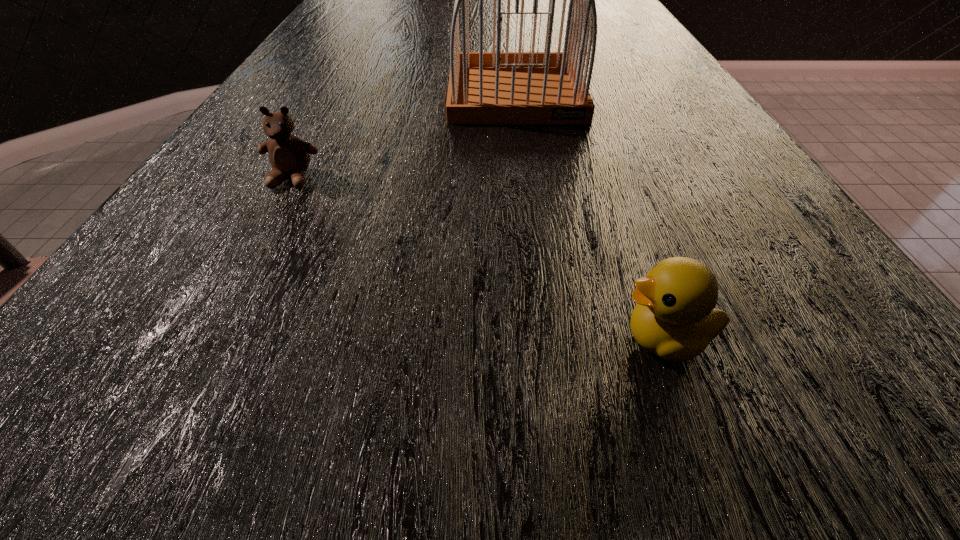
The image size is (960, 540). In order to click on object that is at the left edge in this screenshot , I will do `click(289, 155)`.

This screenshot has width=960, height=540. Find the location of `vacant space at the far edge of the desktop`. vacant space at the far edge of the desktop is located at coordinates (433, 12).

You are a GUI agent. You are given a task and a screenshot of the screen. Output one action in this format:
    pyautogui.click(x=<x>, y=<y>)
    Task: Click on the vacant space at the near edge
    This screenshot has width=960, height=540.
    Given the screenshot: What is the action you would take?
    [619, 487]

In the image, there is a desktop. Identify the location of vacant space at the left edge. This screenshot has width=960, height=540. (355, 32).

Where is `free location at the right edge`? This screenshot has height=540, width=960. free location at the right edge is located at coordinates point(665,168).

This screenshot has height=540, width=960. In the image, there is a desktop. In order to click on free space at the far left corner in this screenshot , I will do pyautogui.click(x=368, y=12).

Locate an element on the screen. Image resolution: width=960 pixels, height=540 pixels. vacant region at the near left corner is located at coordinates (116, 444).

Identify the location of free space that is in between the teddy bear and the duck. The height and width of the screenshot is (540, 960). (479, 259).

Locate an element on the screen. free area in between the tallest object and the leftmost object is located at coordinates pyautogui.click(x=404, y=136).

Where is `vacant space that's between the nearest object and the tallest object`? The image size is (960, 540). vacant space that's between the nearest object and the tallest object is located at coordinates (x=590, y=216).